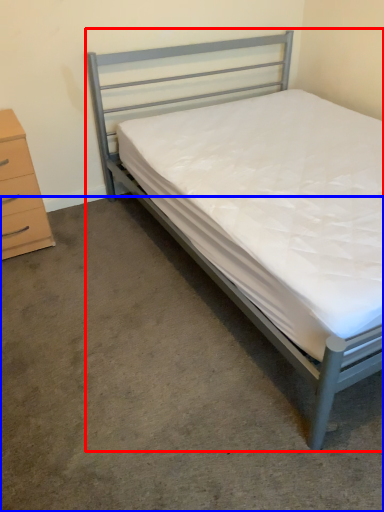
Question: Which point is closer to the camera, bed (highlighted by a red box) or concrete (highlighted by a blue box)?

Choices:
 (A) bed
 (B) concrete

Answer: (A)